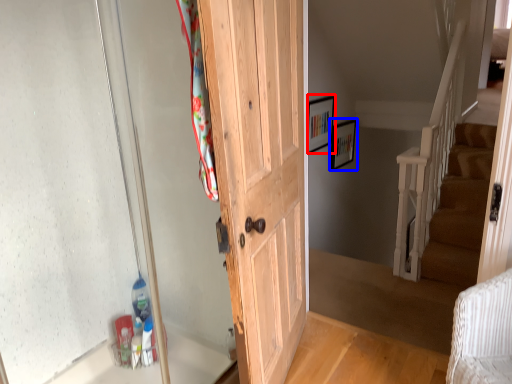
Question: Which object is further to the camera taking this photo, picture frame (highlighted by a red box) or picture frame (highlighted by a blue box)?

Choices:
 (A) picture frame
 (B) picture frame

Answer: (B)